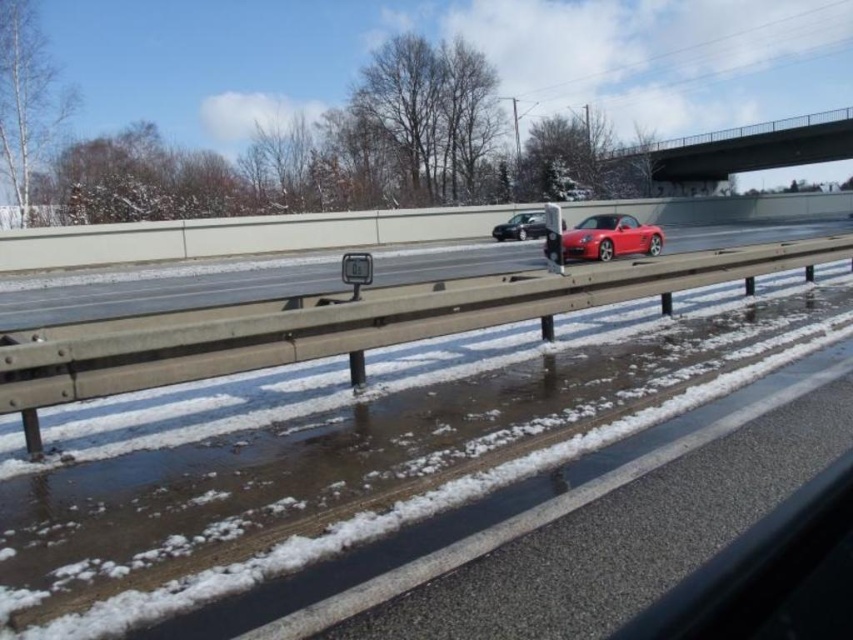
Between concrete bridge at upper center and glossy red convertible at center, which one is positioned higher?

concrete bridge at upper center is higher up.

Between concrete bridge at upper center and glossy red convertible at center, which one has more height?

Standing taller between the two is concrete bridge at upper center.

Locate an element on the screen. The width and height of the screenshot is (853, 640). concrete bridge at upper center is located at coordinates (743, 148).

The width and height of the screenshot is (853, 640). Identify the location of concrete bridge at upper center. (743, 148).

Between point (845, 124) and point (506, 225), which one is positioned behind?

Point (845, 124)

You are a GUI agent. You are given a task and a screenshot of the screen. Output one action in this format:
    pyautogui.click(x=<x>, y=<y>)
    Task: Click on the concrete bridge at upper center
    The height and width of the screenshot is (640, 853).
    Given the screenshot: What is the action you would take?
    pyautogui.click(x=743, y=148)

Who is positioned more to the left, glossy red convertible at center or satin black car at center?

satin black car at center

Is glossy red convertible at center wider than satin black car at center?

Indeed, glossy red convertible at center has a greater width compared to satin black car at center.

Between point (601, 216) and point (498, 224), which one is positioned in front?

Point (601, 216) is more forward.

The width and height of the screenshot is (853, 640). In order to click on glossy red convertible at center in this screenshot , I will do `click(610, 237)`.